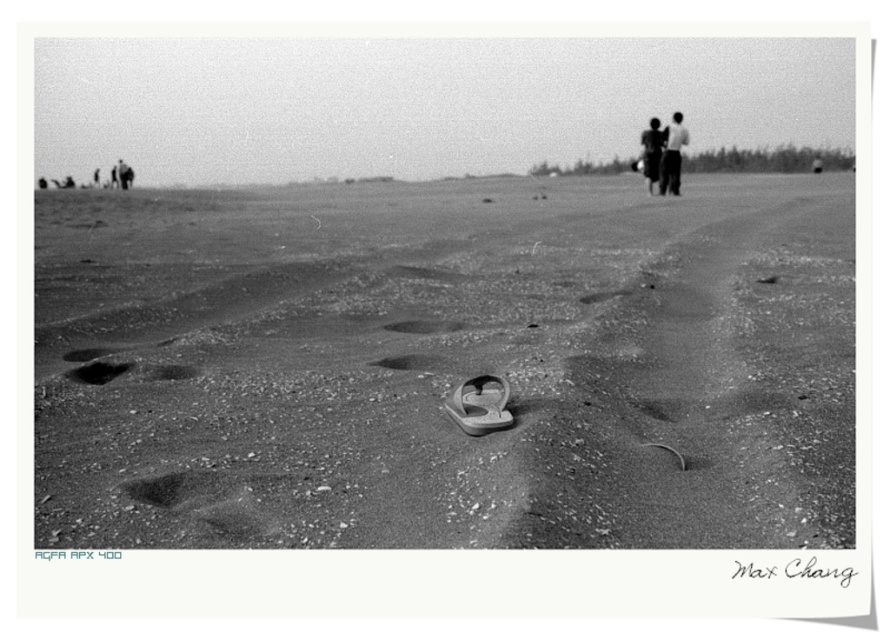
Question: Can you confirm if dark fabric shirt at upper right is bigger than smooth sand at center?

Choices:
 (A) yes
 (B) no

Answer: (A)

Question: Can you confirm if smooth sand flip-flop at center is thinner than dark sand footprint at lower left?

Choices:
 (A) no
 (B) yes

Answer: (A)

Question: Which object appears closest to the camera in this image?

Choices:
 (A) smooth sand flip-flop at center
 (B) gray rubber slipper at center
 (C) smooth skin person at upper right

Answer: (A)

Question: Which object is farther from the camera taking this photo?

Choices:
 (A) smooth sand at center
 (B) dark sand footprint at lower left
 (C) gray rubber slipper at center
 (D) dark fabric shirt at upper right

Answer: (D)

Question: Can you confirm if dark fabric shirt at upper right is positioned to the right of smooth skin person at upper right?

Choices:
 (A) yes
 (B) no

Answer: (A)

Question: Based on their relative distances, which object is nearer to the gray rubber slipper at center?

Choices:
 (A) dark fabric shirt at upper right
 (B) smooth skin person at upper right
 (C) smooth sand flip-flop at center

Answer: (C)